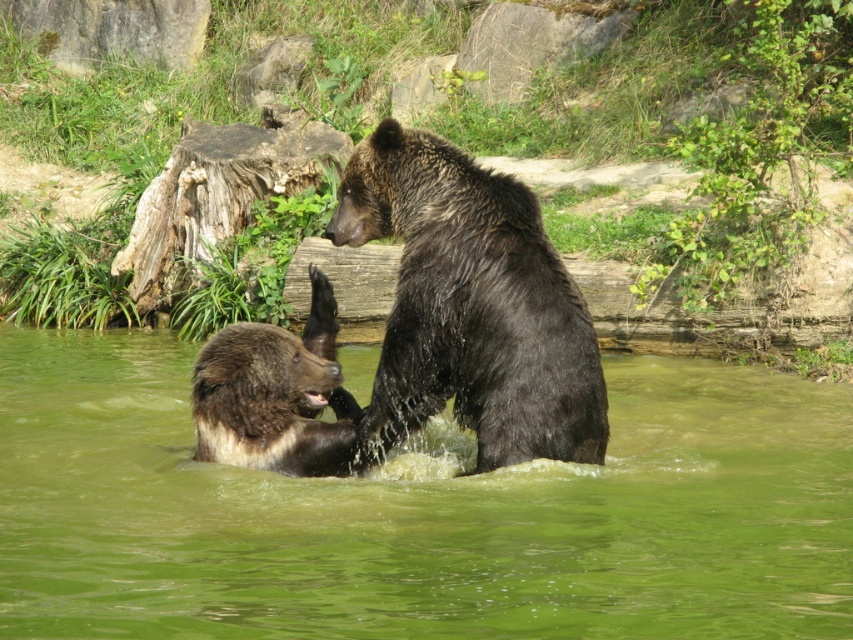
Question: Estimate the real-world distances between objects in this image. Which object is closer to the green water at center?

Choices:
 (A) brown furry bear at center
 (B) shiny dark fur bear at center

Answer: (B)

Question: Which object is positioned farthest from the brown furry bear at center?

Choices:
 (A) green water at center
 (B) shiny dark fur bear at center

Answer: (A)

Question: Is the position of green water at center more distant than that of brown furry bear at center?

Choices:
 (A) yes
 (B) no

Answer: (B)

Question: Does green water at center appear under brown furry bear at center?

Choices:
 (A) yes
 (B) no

Answer: (A)

Question: Is shiny dark fur bear at center closer to the viewer compared to brown furry bear at center?

Choices:
 (A) no
 (B) yes

Answer: (B)

Question: Which point is closer to the camera?

Choices:
 (A) click(585, 365)
 (B) click(105, 532)

Answer: (A)